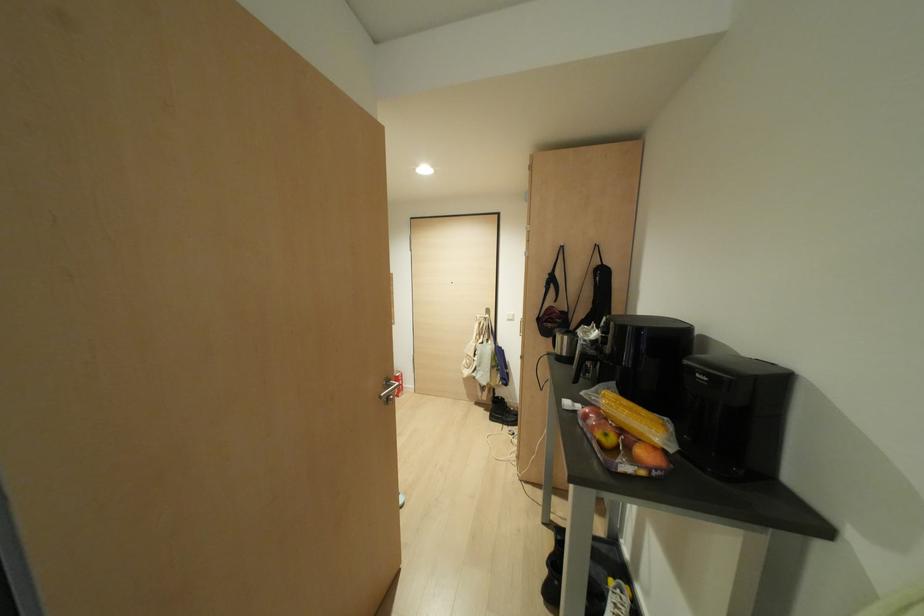
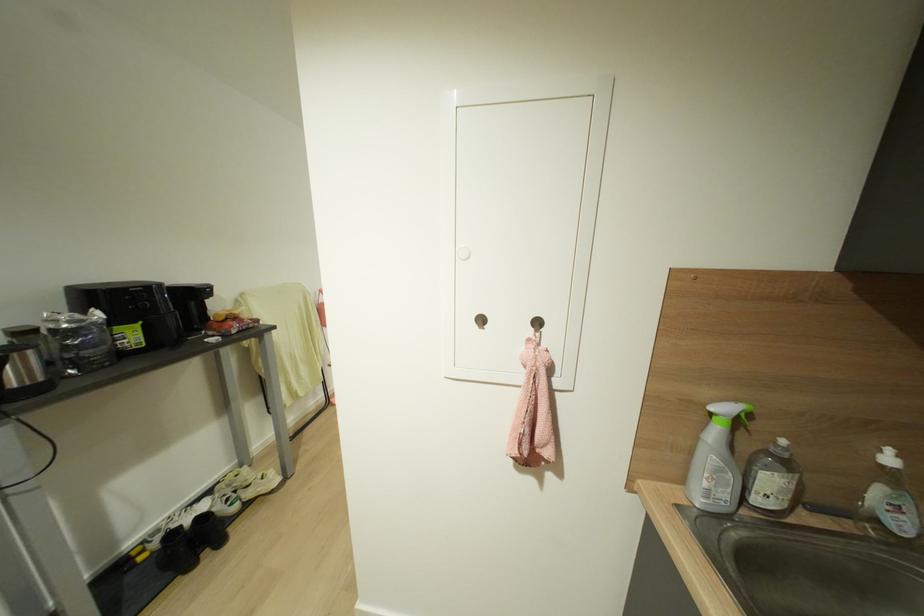
Question: I am providing you with two images of the same scene from different viewpoints. Please identify which objects are invisible in image2.

Choices:
 (A) black hanging case
 (B) white cabinet knob
 (C) brown shaker jar
 (D) metal wall hook

Answer: (A)